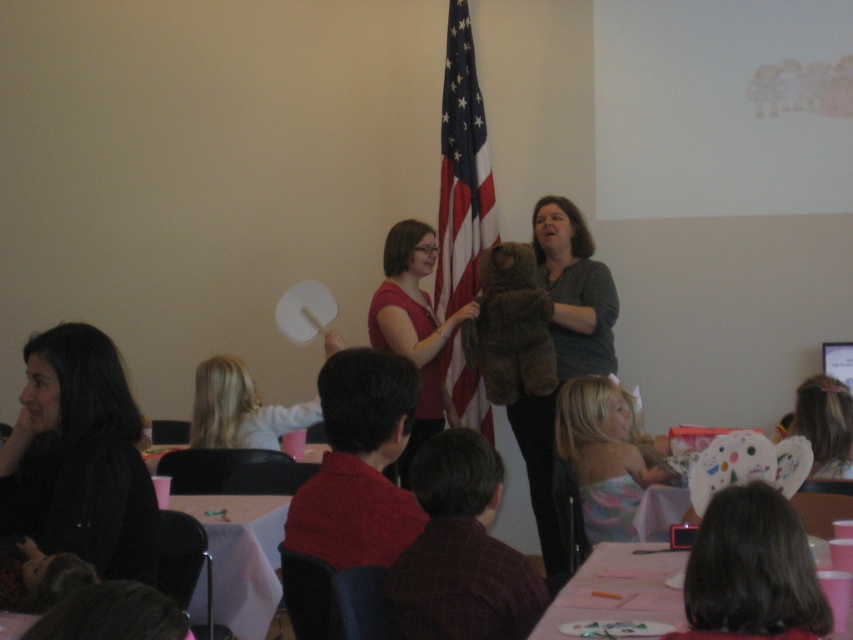
You are a teacher in a classroom and want to place a new decoration between the brown fuzzy teddy bear at center and the pink paper plates at lower right. Where should you place it so it is between them?

The brown fuzzy teddy bear at center is above the pink paper plates at lower right, so placing the decoration between them would require positioning it below the teddy bear and above the pink paper plates at lower right.

You are a photographer trying to capture a closeup of the brown fuzzy teddy bear at center without including the black matte hair at lower left in the frame. Given their heights, can you position yourself so that the teddy bear is fully visible while the hair is out of the shot?

The black matte hair at lower left is shorter than the brown fuzzy teddy bear at center. Since the hair is shorter, positioning the camera above the hair level would allow the teddy bear to be fully visible while excluding the hair from the frame.

You are organizing a classroom activity and need to place the brown fuzzy teddy bear at center and the pink paper plates at lower right on a shelf. If the shelf has limited height, which item might not fit if the shelf is only 10 cm tall?

The brown fuzzy teddy bear at center is taller than the pink paper plates at lower right. If the shelf is only 10 cm tall, the brown fuzzy teddy bear at center might not fit due to its greater height.